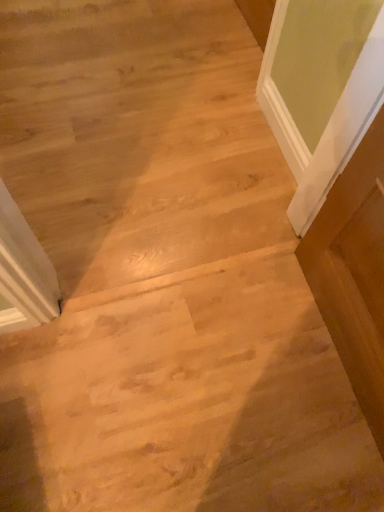
Identify the location of free space to the left of wooden door at right. (208, 354).